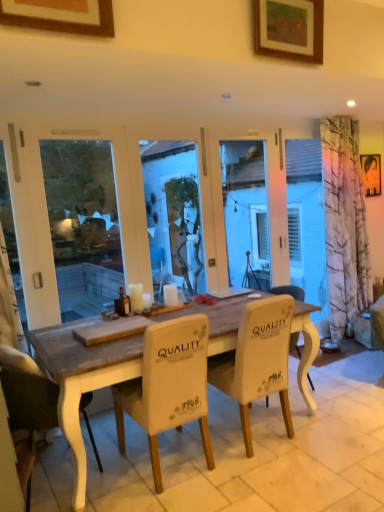
This screenshot has width=384, height=512. I want to click on vacant area that is situated to the right of white fabric chair at center, which is the first chair in right-to-left order, so click(x=336, y=432).